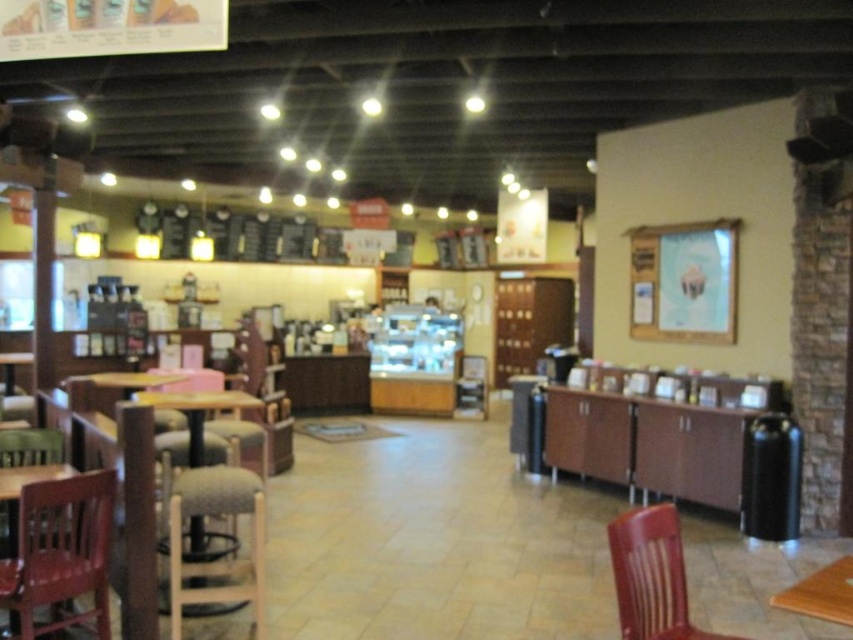
Can you confirm if fabric cushioned bar stool at lower left is bigger than brown wood table at lower right?

Indeed, fabric cushioned bar stool at lower left has a larger size compared to brown wood table at lower right.

Is point (169, 576) positioned after point (840, 600)?

Yes, it is.

Where is `fabric cushioned bar stool at lower left`? fabric cushioned bar stool at lower left is located at coordinates (213, 561).

Is brown wooden chair at lower right taller than wooden table at center?

Correct, brown wooden chair at lower right is much taller as wooden table at center.

Is point (653, 564) less distant than point (206, 556)?

Yes, point (653, 564) is in front of point (206, 556).

The height and width of the screenshot is (640, 853). What are the coordinates of `brown wooden chair at lower right` in the screenshot? It's located at (651, 576).

Which is more to the left, wooden chair at lower left or brown wood table at lower right?

wooden chair at lower left is more to the left.

Is wooden chair at lower left closer to camera compared to brown wood table at lower right?

That is False.

You are a GUI agent. You are given a task and a screenshot of the screen. Output one action in this format:
    pyautogui.click(x=<x>, y=<y>)
    Task: Click on the wooden chair at lower left
    
    Given the screenshot: What is the action you would take?
    pyautogui.click(x=61, y=552)